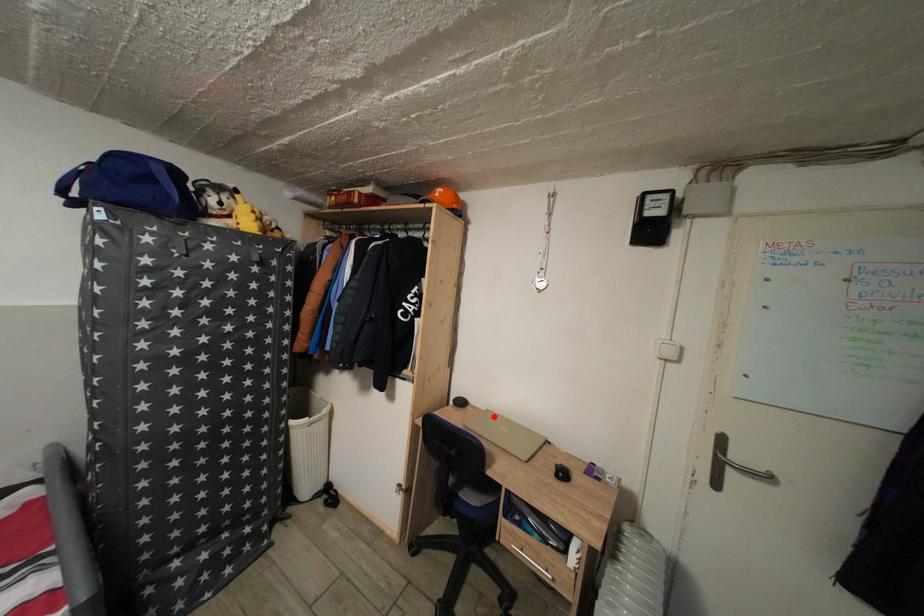
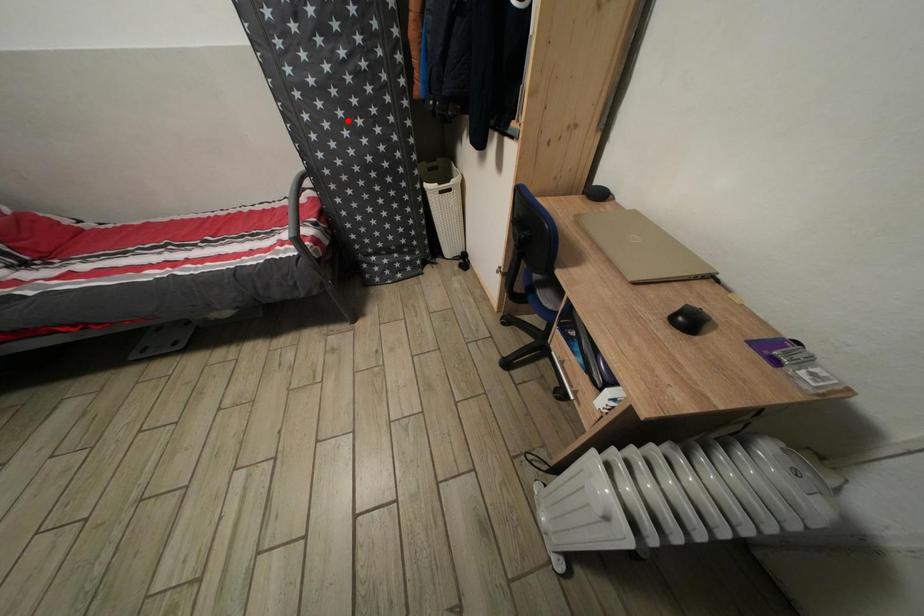
I am providing you with two images of the same scene from different viewpoints. A red point is marked on the first image and another point is marked on the second image. Does the point marked in image1 correspond to the same location as the one in image2?

No